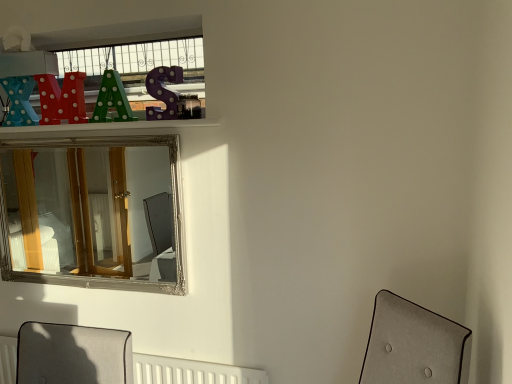
Question: From the image's perspective, is white textured radiator at lower center on silver/gilded mirror at upper center?

Choices:
 (A) no
 (B) yes

Answer: (A)

Question: Can you confirm if white textured radiator at lower center is thinner than silver/gilded mirror at upper center?

Choices:
 (A) no
 (B) yes

Answer: (B)

Question: Can you confirm if white textured radiator at lower center is shorter than silver/gilded mirror at upper center?

Choices:
 (A) yes
 (B) no

Answer: (A)

Question: From a real-world perspective, is white textured radiator at lower center beneath silver/gilded mirror at upper center?

Choices:
 (A) no
 (B) yes

Answer: (B)

Question: Does white textured radiator at lower center touch silver/gilded mirror at upper center?

Choices:
 (A) no
 (B) yes

Answer: (A)

Question: Does white textured radiator at lower center turn towards silver/gilded mirror at upper center?

Choices:
 (A) no
 (B) yes

Answer: (A)

Question: Is silver/gilded mirror at upper center positioned beyond the bounds of white textured radiator at lower center?

Choices:
 (A) yes
 (B) no

Answer: (A)

Question: Considering the relative positions of silver/gilded mirror at upper center and white textured radiator at lower center in the image provided, is silver/gilded mirror at upper center to the right of white textured radiator at lower center from the viewer's perspective?

Choices:
 (A) yes
 (B) no

Answer: (B)

Question: Is silver/gilded mirror at upper center smaller than white textured radiator at lower center?

Choices:
 (A) yes
 (B) no

Answer: (B)

Question: From the image's perspective, is silver/gilded mirror at upper center on white textured radiator at lower center?

Choices:
 (A) no
 (B) yes

Answer: (B)

Question: From a real-world perspective, is silver/gilded mirror at upper center beneath white textured radiator at lower center?

Choices:
 (A) no
 (B) yes

Answer: (A)

Question: Can you confirm if silver/gilded mirror at upper center is shorter than white textured radiator at lower center?

Choices:
 (A) no
 (B) yes

Answer: (A)

Question: Considering the relative positions of white textured radiator at lower center and silver/gilded mirror at upper center in the image provided, is white textured radiator at lower center to the left or to the right of silver/gilded mirror at upper center?

Choices:
 (A) right
 (B) left

Answer: (A)